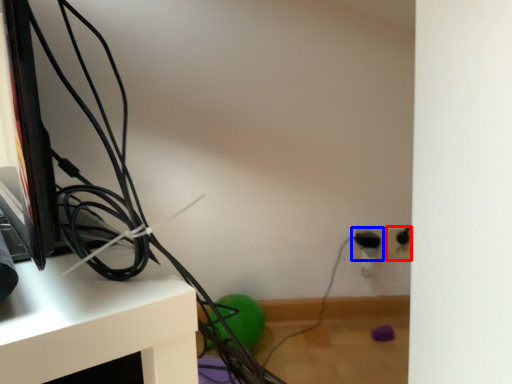
Question: Among these objects, which one is nearest to the camera, electric outlet (highlighted by a red box) or electric outlet (highlighted by a blue box)?

Choices:
 (A) electric outlet
 (B) electric outlet

Answer: (B)